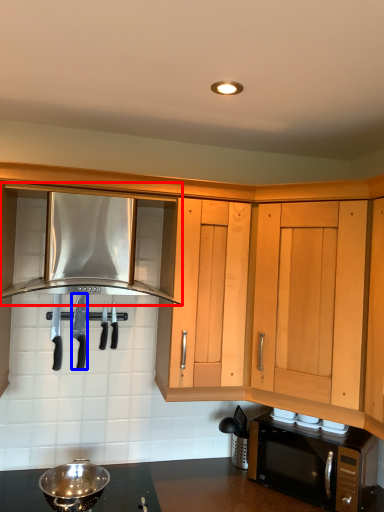
Question: Which of the following is the farthest to the observer, cabinetry (highlighted by a red box) or knife (highlighted by a blue box)?

Choices:
 (A) cabinetry
 (B) knife

Answer: (B)